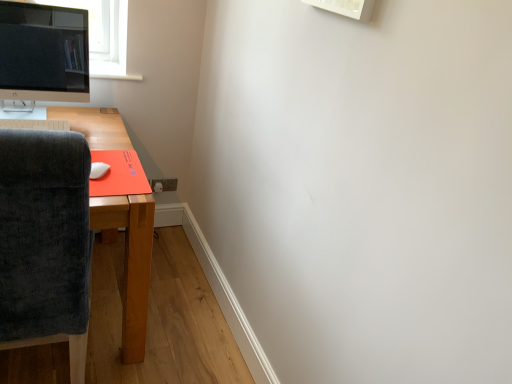
Question: From a real-world perspective, relative to white matte mouse at lower left, is brown plastic power outlet at lower center vertically above or below?

Choices:
 (A) above
 (B) below

Answer: (B)

Question: Looking at the image, does brown plastic power outlet at lower center seem bigger or smaller compared to white matte mouse at lower left?

Choices:
 (A) small
 (B) big

Answer: (A)

Question: Considering the real-world distances, which object is farthest from the dark gray fabric chair at left?

Choices:
 (A) satin black monitor at upper left
 (B) white plastic keyboard at lower left
 (C) white matte mouse at lower left
 (D) brown plastic power outlet at lower center

Answer: (D)

Question: Which object is the closest to the dark gray fabric chair at left?

Choices:
 (A) white plastic keyboard at lower left
 (B) satin black monitor at upper left
 (C) white matte mouse at lower left
 (D) brown plastic power outlet at lower center

Answer: (A)